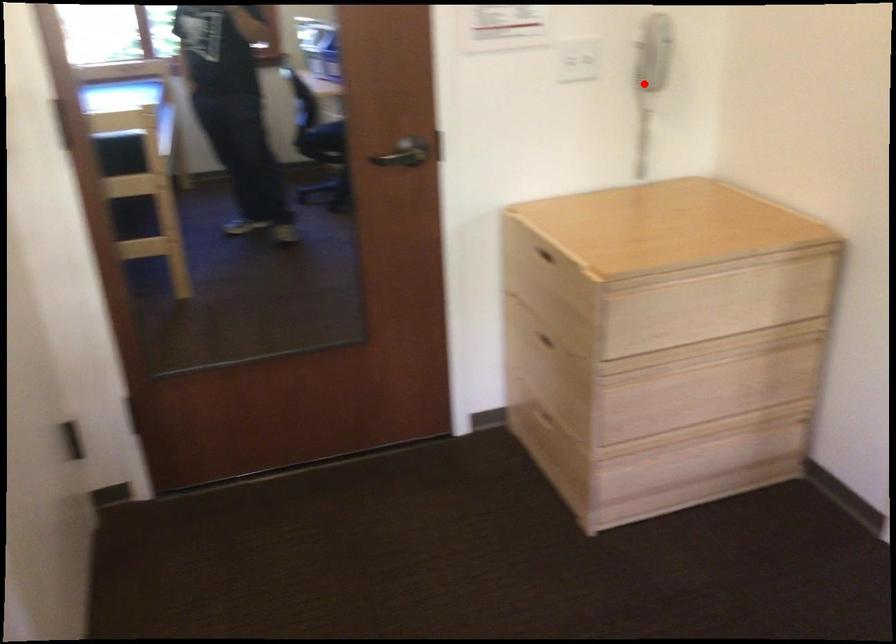
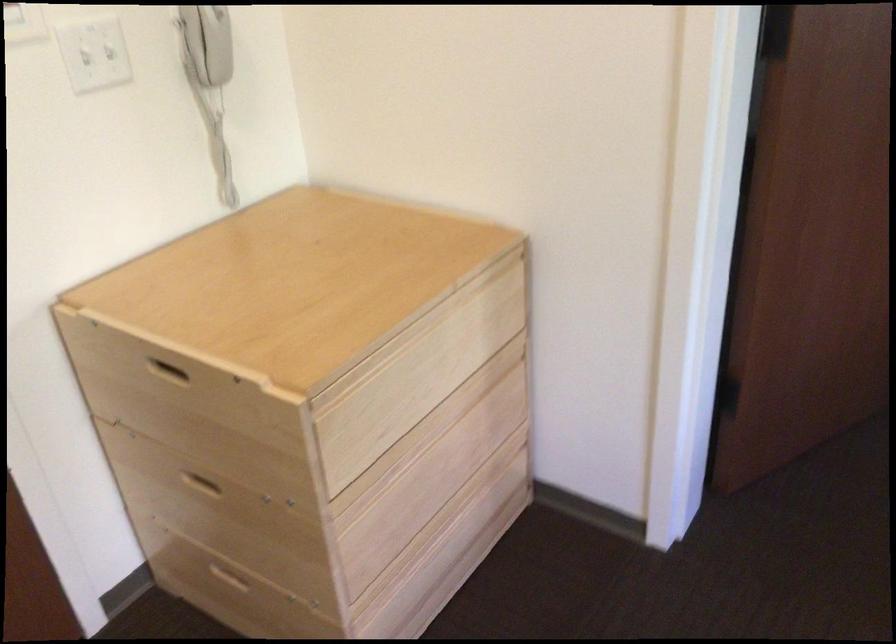
Find the pixel in the second image that matches the highlighted location in the first image.

(210, 82)